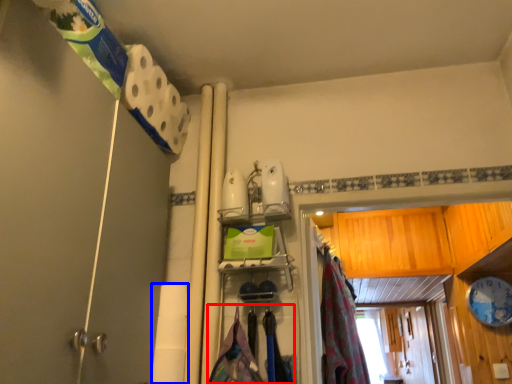
Question: Which object is closer to the camera taking this photo, laundry (highlighted by a red box) or toilet paper (highlighted by a blue box)?

Choices:
 (A) laundry
 (B) toilet paper

Answer: (A)